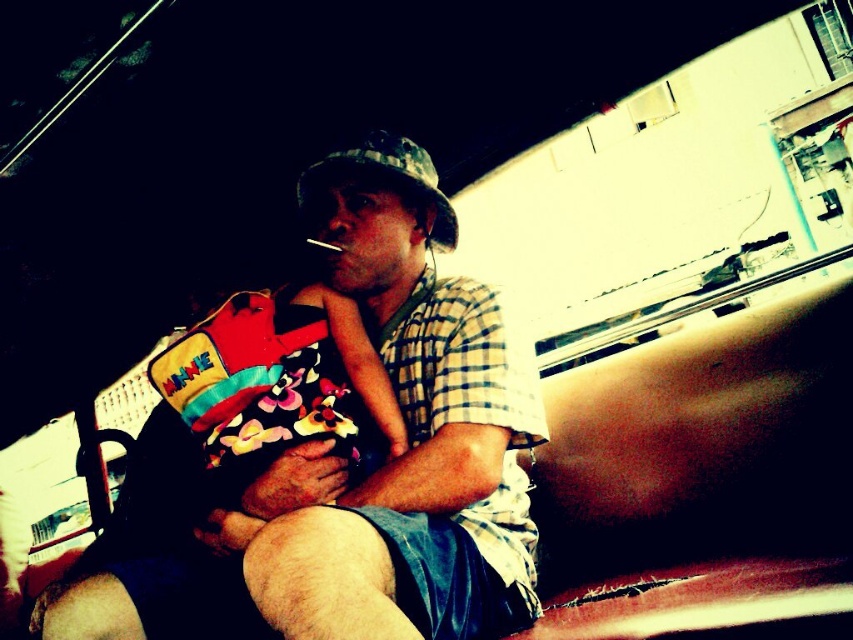
Question: Does matte plaid shirt at center have a lesser width compared to camouflage fabric baseball hat at center?

Choices:
 (A) no
 (B) yes

Answer: (A)

Question: Observing the image, what is the correct spatial positioning of matte plaid shirt at center in reference to camouflage fabric baseball hat at center?

Choices:
 (A) below
 (B) above

Answer: (A)

Question: Which point appears closest to the camera in this image?

Choices:
 (A) (312, 177)
 (B) (183, 513)

Answer: (B)

Question: In this image, where is matte plaid shirt at center located relative to camouflage fabric baseball hat at center?

Choices:
 (A) below
 (B) above

Answer: (A)

Question: Which point is closer to the camera taking this photo?

Choices:
 (A) (448, 221)
 (B) (157, 552)

Answer: (B)